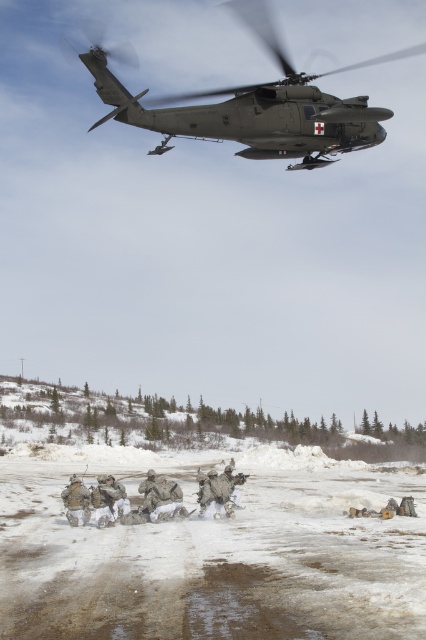
Does matte green helicopter at upper center appear over camouflage fabric uniform at center?

Correct, matte green helicopter at upper center is located above camouflage fabric uniform at center.

Looking at this image, is matte green helicopter at upper center taller than camouflage fabric uniform at center?

Correct, matte green helicopter at upper center is much taller as camouflage fabric uniform at center.

You are a GUI agent. You are given a task and a screenshot of the screen. Output one action in this format:
    pyautogui.click(x=<x>, y=<y>)
    Task: Click on the matte green helicopter at upper center
    
    Given the screenshot: What is the action you would take?
    pyautogui.click(x=252, y=104)